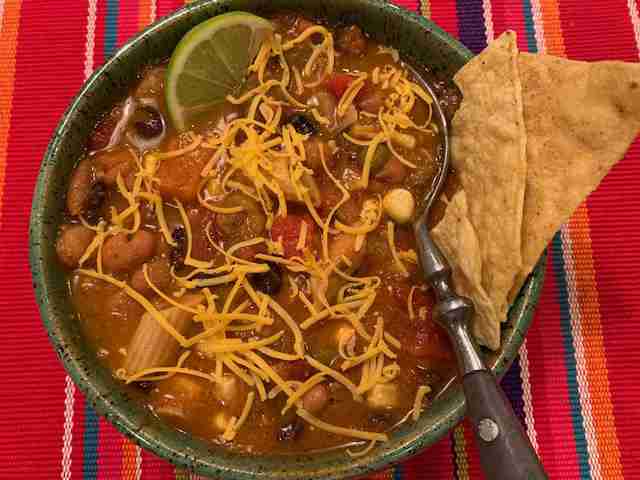
This screenshot has height=480, width=640. I want to click on handle, so click(x=502, y=466).